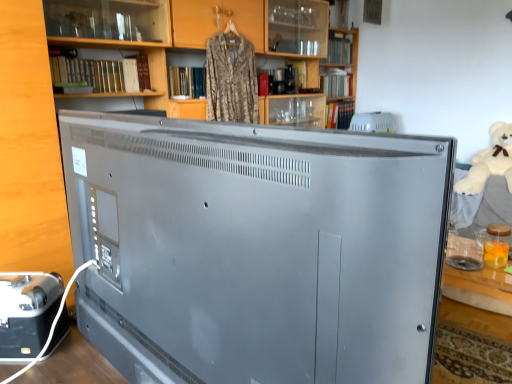
Question: Is point (316, 77) closer or farther from the camera than point (58, 278)?

Choices:
 (A) farther
 (B) closer

Answer: (A)

Question: Is matte wood bookcase at upper center in front of or behind metallic silver toaster at lower left, which is the first appliance from front to back, in the image?

Choices:
 (A) behind
 (B) front

Answer: (A)

Question: Estimate the real-world distances between objects in this image. Which object is closer to the matte wood bookcase at upper center?

Choices:
 (A) camouflage fabric shirt at upper center
 (B) satin gray television at center
 (C) white plastic speaker at upper center, placed as the 2th appliance when sorted from bottom to top
 (D) metallic silver toaster at lower left, which is the 2th appliance in back-to-front order
 (E) white plush bear at right

Answer: (A)

Question: Estimate the real-world distances between objects in this image. Which object is farther from the metallic silver toaster at lower left, which is the 2th appliance in back-to-front order?

Choices:
 (A) satin gray television at center
 (B) white plastic speaker at upper center, placed as the 2th appliance when sorted from bottom to top
 (C) camouflage fabric shirt at upper center
 (D) white plush bear at right
 (E) matte wood bookcase at upper center

Answer: (D)